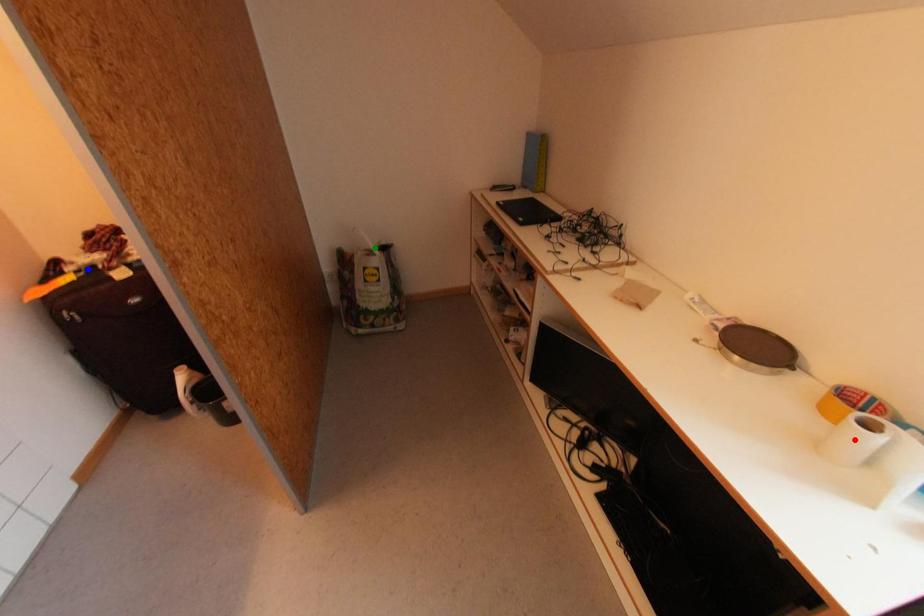
Order these from nearest to farthest:
1. blue point
2. green point
3. red point

green point → blue point → red point